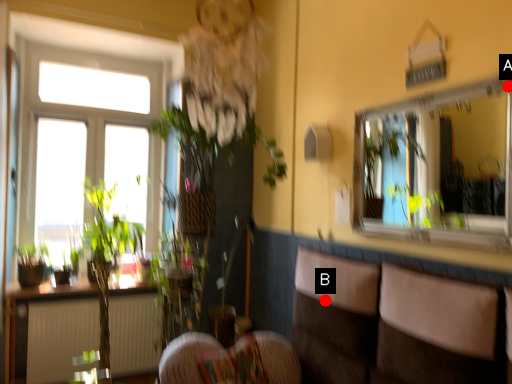
Question: Two points are circled on the image, labeled by A and B beside each circle. Which point is farther from the camera taking this photo?

Choices:
 (A) A is further
 (B) B is further

Answer: (B)